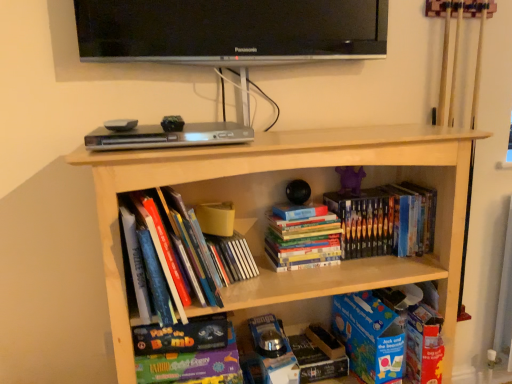
This screenshot has width=512, height=384. What are the coordinates of `vacant space to the right of purple matte toy at center` in the screenshot? It's located at (386, 187).